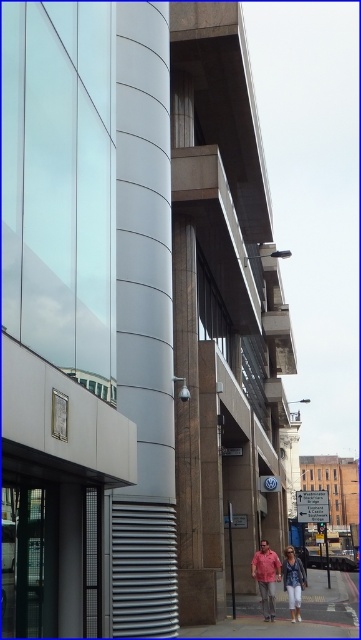
Can you confirm if concrete sidewalk at lower center is thinner than matte pink shirt at lower center?

No, concrete sidewalk at lower center is not thinner than matte pink shirt at lower center.

Is concrete sidewalk at lower center to the left of matte pink shirt at lower center from the viewer's perspective?

No, concrete sidewalk at lower center is not to the left of matte pink shirt at lower center.

Where is `concrete sidewalk at lower center`? This screenshot has width=361, height=640. concrete sidewalk at lower center is located at coordinates (301, 611).

Is matte pink shirt at lower center shorter than denim jacket at lower center?

Correct, matte pink shirt at lower center is not as tall as denim jacket at lower center.

Can you confirm if matte pink shirt at lower center is positioned above denim jacket at lower center?

Indeed, matte pink shirt at lower center is positioned over denim jacket at lower center.

Identify the location of matte pink shirt at lower center. (266, 577).

Identify the location of matte pink shirt at lower center. The image size is (361, 640). (266, 577).

Can you confirm if concrete sidewalk at lower center is positioned to the left of denim jacket at lower center?

In fact, concrete sidewalk at lower center is to the right of denim jacket at lower center.

Which is behind, point (312, 616) or point (289, 563)?

The point (312, 616) is more distant.

Between point (322, 580) and point (301, 586), which one is positioned behind?

Point (322, 580)

Identify the location of concrete sidewalk at lower center. (301, 611).